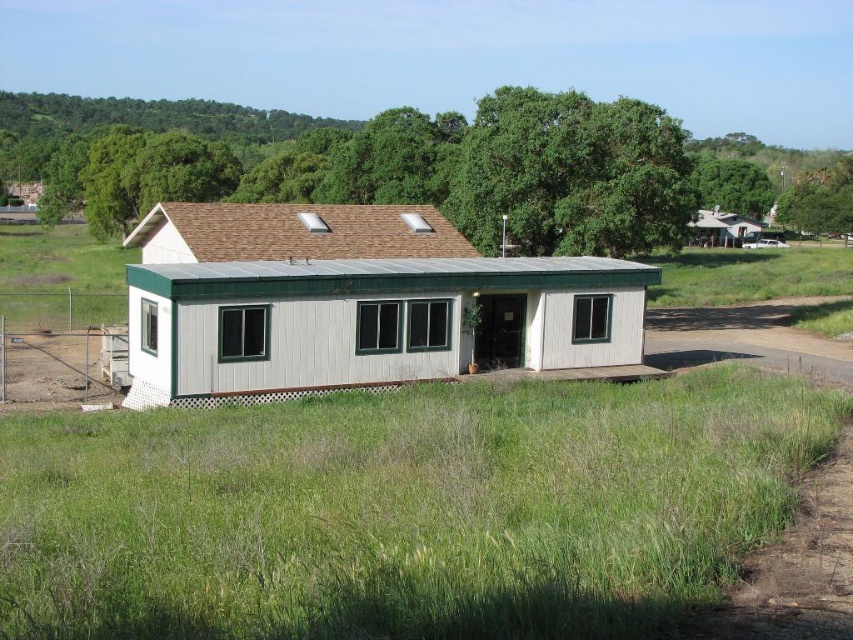
Looking at this image, you are a gardener who wants to mow the lawn around the white wood cabin at center. Based on the scene, can you determine if the green grass at lower center is tall enough to require mowing?

The green grass at lower center is shorter than the white wood cabin at center. However, the cabin is a structure and cannot be compared to grass height for mowing purposes. To determine if mowing is needed, you should assess the grass height relative to typical mowing standards, not the cabin.

You are planning to set up a picnic blanket in the green grass at lower center near the white wood cabin at center. Considering the space available, will the grass area be sufficient to accommodate a standard picnic blanket that is 2 meters by 3 meters?

The green grass at lower center is thinner than the white wood cabin at center, but the description does not provide specific measurements of the grass area. However, since the grass is at the lower center and the cabin is central, there might be enough space around the cabin for a 2m x 3m picnic blanket. Check the actual dimensions before setting up.

You are standing at the entrance of the building and want to place a small garden decoration exactly at the position of the green grass at lower center. What are the coordinates where you should place it?

The coordinates for the green grass at lower center are at point (404, 509). Place the garden decoration there.